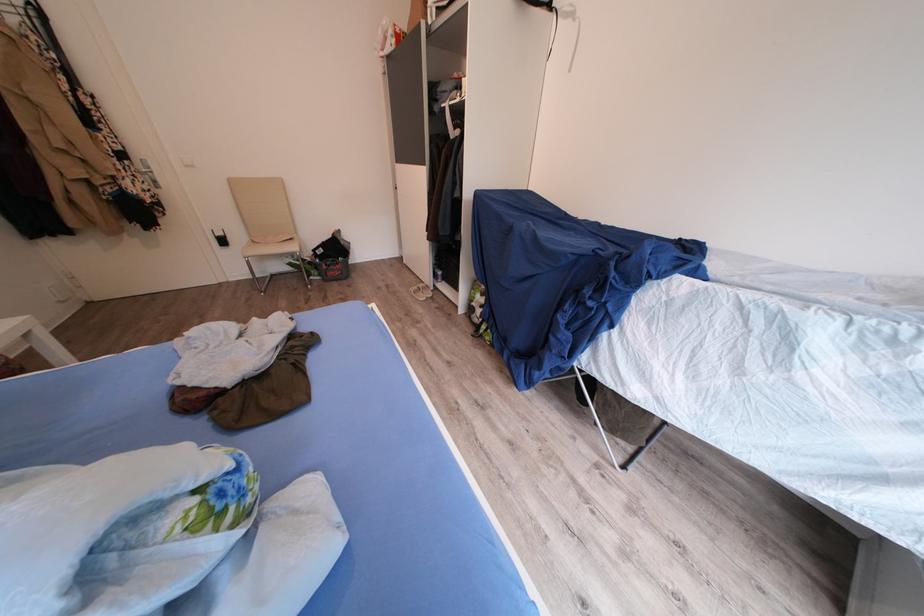
The location [119,529] corresponds to which object?

This point indicates the patterned pillow.